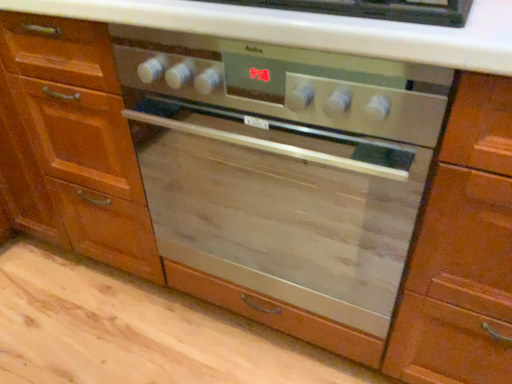
Where is `satin silver oven at center`? The width and height of the screenshot is (512, 384). satin silver oven at center is located at coordinates pos(282,207).

Measure the distance between satin silver oven at center and camera.

satin silver oven at center and camera are 25.23 inches apart.

Describe the element at coordinates (282, 207) in the screenshot. I see `satin silver oven at center` at that location.

Where is `satin silver oven at center`? Image resolution: width=512 pixels, height=384 pixels. satin silver oven at center is located at coordinates (282, 207).